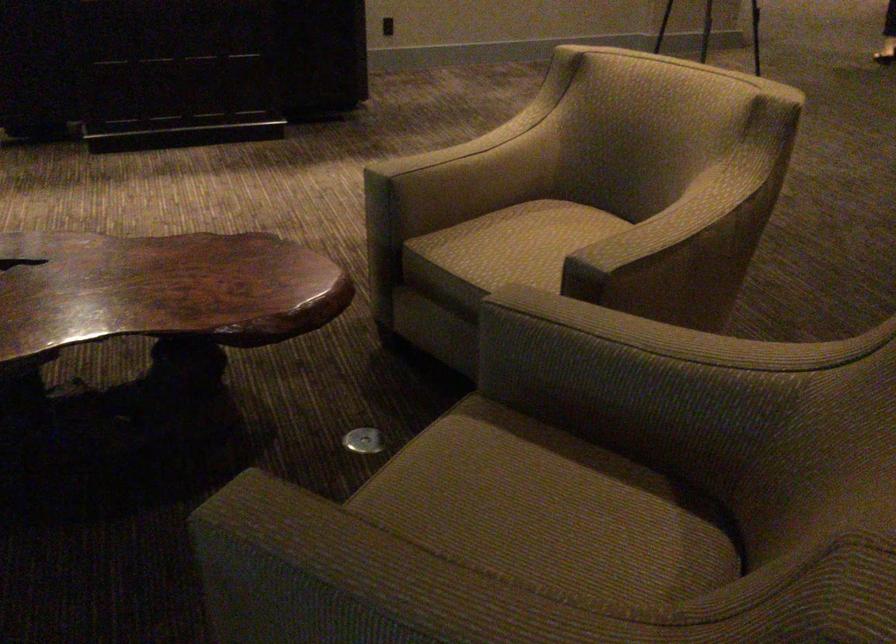
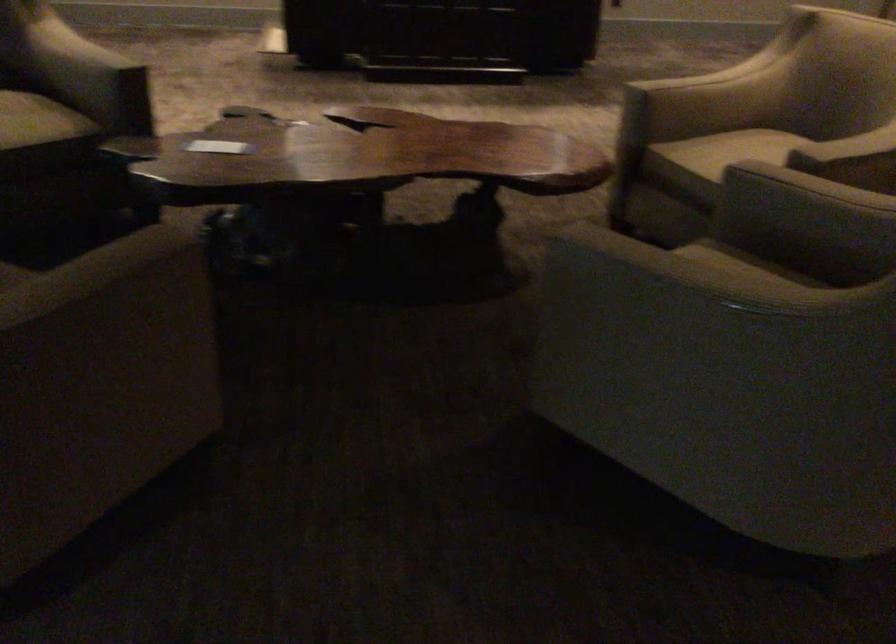
Question: Which direction would the cameraman need to move to produce the second image? Reply with the corresponding letter.

Choices:
 (A) Left
 (B) Right
 (C) Forward
 (D) Backward

Answer: (D)